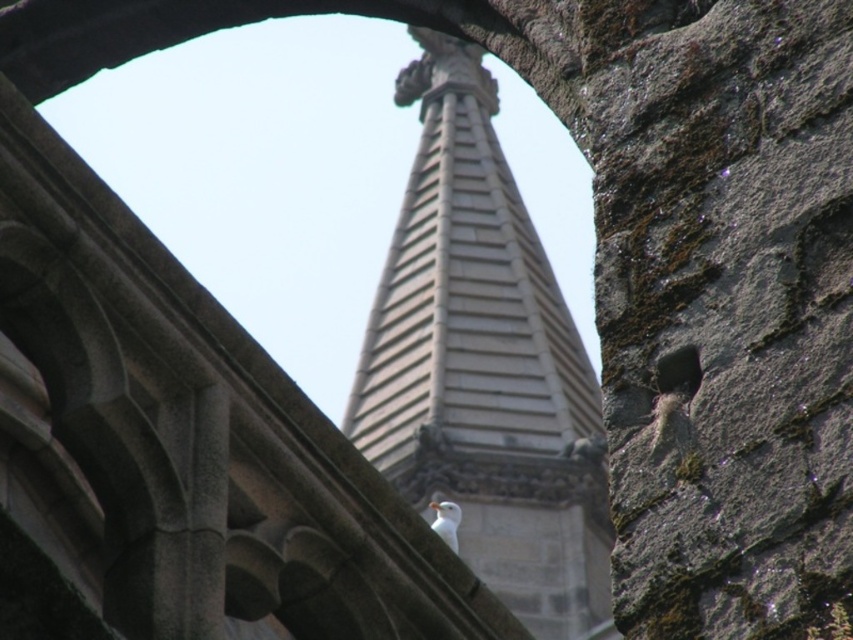
Is gray stone tower at center further to camera compared to white feathered bird at center?

Yes, gray stone tower at center is behind white feathered bird at center.

Who is more forward, (430, 452) or (456, 502)?

Point (456, 502)

Where is `gray stone tower at center`? gray stone tower at center is located at coordinates (x=485, y=364).